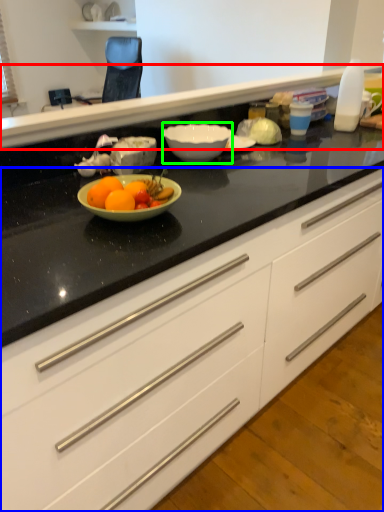
Question: Based on their relative distances, which object is farther from counter top (highlighted by a red box)? Choose from cabinetry (highlighted by a blue box) and bowl (highlighted by a green box).

Choices:
 (A) cabinetry
 (B) bowl

Answer: (A)